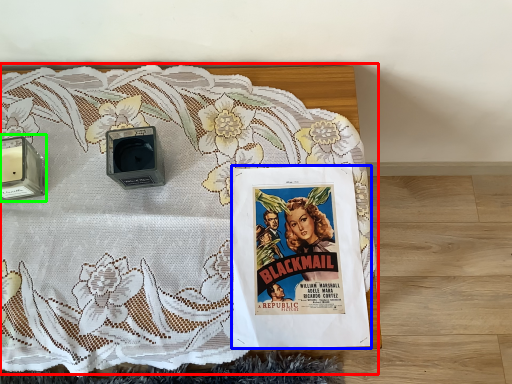
Question: Based on their relative distances, which object is nearer to bed (highlighted by a red box)? Choose from comic book (highlighted by a blue box) and speaker (highlighted by a green box).

Choices:
 (A) comic book
 (B) speaker

Answer: (A)